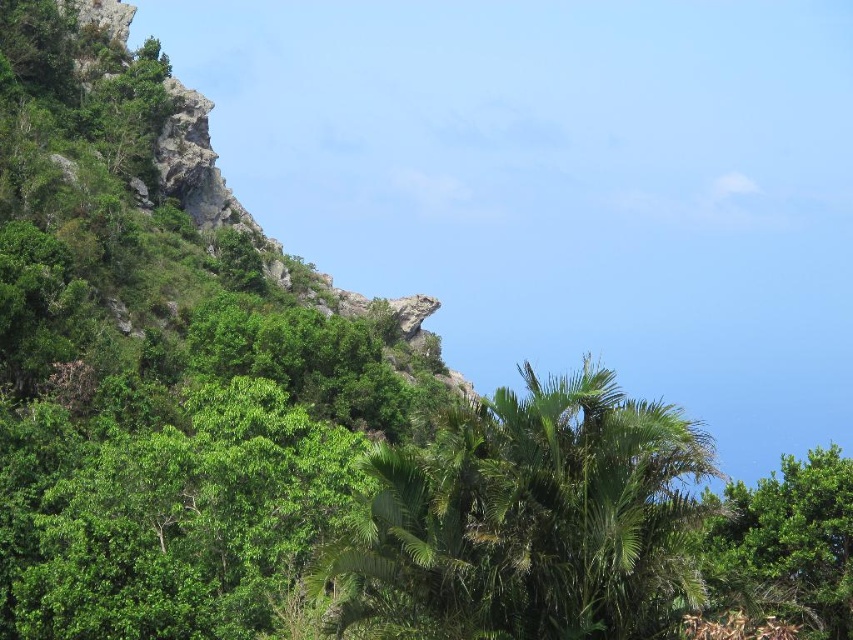
Question: Can you confirm if rugged stone mountain at upper left is bigger than green leafy palm at center?

Choices:
 (A) yes
 (B) no

Answer: (A)

Question: Which point is closer to the camera taking this photo?

Choices:
 (A) (647, 579)
 (B) (746, 493)

Answer: (A)

Question: Does rugged stone mountain at upper left have a smaller size compared to green leafy palm at center?

Choices:
 (A) no
 (B) yes

Answer: (A)

Question: Which point appears farthest from the camera in this image?

Choices:
 (A) (759, 563)
 (B) (28, 67)
 (C) (578, 588)

Answer: (B)

Question: Which object appears closest to the camera in this image?

Choices:
 (A) green leafy tree at lower right
 (B) green leafy palm at center

Answer: (B)

Question: Is rugged stone mountain at upper left positioned before green leafy tree at lower right?

Choices:
 (A) no
 (B) yes

Answer: (B)